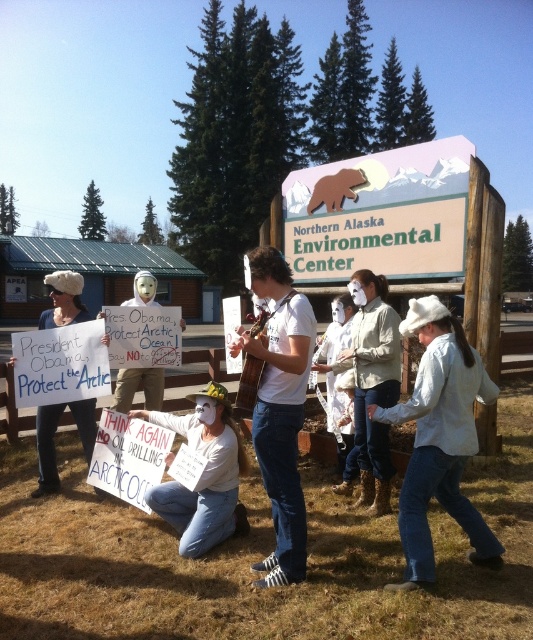
You are standing at the center of the image. Looking towards the lower right corner, can you see the white denim jeans at lower right? Please explain your line of sight.

Yes, the white denim jeans at lower right are located at the lower right corner of the image, so you can see them by looking towards the lower right direction from the center.

You are a photographer at the Northern Alaska Environmental Center event. You need to capture a photo where both the white matte mask at center and the white fur hat at left are visible. Given their heights, which object should be placed closer to the camera to ensure both are fully visible in the frame?

The white matte mask at center is shorter than the white fur hat at left. To ensure both are fully visible, position the white matte mask at center closer to the camera so its smaller size can be captured without being obscured by the taller white fur hat at left.